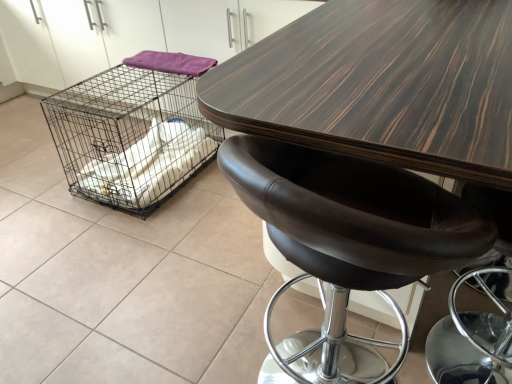
Describe the element at coordinates (381, 85) in the screenshot. I see `dark wood table at center` at that location.

What are the coordinates of `purple fabric at upper left` in the screenshot? It's located at (170, 63).

Measure the distance between point (445,224) and camera.

They are 65.10 centimeters apart.

Measure the distance between point (130, 118) and camera.

The depth of point (130, 118) is 9.49 feet.

Where is `dark wood table at center`? The image size is (512, 384). dark wood table at center is located at coordinates (x=381, y=85).

Considering the relative sizes of brown leather stool at center and purple fabric at upper left in the image provided, is brown leather stool at center wider than purple fabric at upper left?

Yes.

Is brown leather stool at center at the left side of purple fabric at upper left?

Incorrect, brown leather stool at center is not on the left side of purple fabric at upper left.

Is brown leather stool at center next to purple fabric at upper left and touching it?

brown leather stool at center is not next to purple fabric at upper left, and they're not touching.

Is brown leather stool at center smaller than purple fabric at upper left?

Actually, brown leather stool at center might be larger than purple fabric at upper left.

Looking at this image, are dark wood table at center and brown leather stool at center making contact?

There is a gap between dark wood table at center and brown leather stool at center.

Does dark wood table at center have a greater width compared to brown leather stool at center?

Yes.

Considering the positions of objects dark wood table at center and brown leather stool at center in the image provided, who is in front, dark wood table at center or brown leather stool at center?

brown leather stool at center.

From a real-world perspective, is dark wood table at center on top of brown leather stool at center?

Yes.

From the image's perspective, which one is positioned higher, black wire mesh cage at left or purple fabric at upper left?

purple fabric at upper left.

Can you confirm if black wire mesh cage at left is positioned to the right of purple fabric at upper left?

No.

From a real-world perspective, is black wire mesh cage at left under purple fabric at upper left?

Indeed, from a real-world perspective, black wire mesh cage at left is positioned beneath purple fabric at upper left.

Do you think black wire mesh cage at left is within purple fabric at upper left, or outside of it?

black wire mesh cage at left is located beyond the bounds of purple fabric at upper left.

Which is more to the right, dark wood table at center or black wire mesh cage at left?

Positioned to the right is dark wood table at center.

Who is bigger, dark wood table at center or black wire mesh cage at left?

→ Bigger between the two is dark wood table at center.

Which is nearer, [380,32] or [97,187]?

Point [380,32].

Who is shorter, dark wood table at center or black wire mesh cage at left?

With less height is black wire mesh cage at left.

Is brown leather stool at center positioned with its back to black wire mesh cage at left?

No, brown leather stool at center is not facing away from black wire mesh cage at left.

From a real-world perspective, is brown leather stool at center positioned over black wire mesh cage at left based on gravity?

Yes, from a real-world perspective, brown leather stool at center is above black wire mesh cage at left.

Measure the distance between brown leather stool at center and black wire mesh cage at left.

brown leather stool at center and black wire mesh cage at left are 5.22 feet apart from each other.

Is brown leather stool at center far from black wire mesh cage at left?

Yes, brown leather stool at center and black wire mesh cage at left are quite far apart.

Consider the image. From a real-world perspective, is purple fabric at upper left physically below brown leather stool at center?

No, from a real-world perspective, purple fabric at upper left is not beneath brown leather stool at center.

Who is shorter, purple fabric at upper left or brown leather stool at center?

Standing shorter between the two is purple fabric at upper left.

How different are the orientations of purple fabric at upper left and brown leather stool at center in degrees?

177 degrees.

Between purple fabric at upper left and black wire mesh cage at left, which one has larger width?

black wire mesh cage at left.

Which is more to the left, purple fabric at upper left or black wire mesh cage at left?

Positioned to the left is black wire mesh cage at left.

At what (x,y) coordinates should I click in order to perform the action: click on bird cage below the purple fabric at upper left (from the image's perspective). Please return your answer as a coordinate pair (x, y). Looking at the image, I should click on (133, 131).

Consider the image. Is purple fabric at upper left positioned in front of black wire mesh cage at left?

No, purple fabric at upper left is behind black wire mesh cage at left.

Where is `chair that appears on the right of purple fabric at upper left`? The image size is (512, 384). chair that appears on the right of purple fabric at upper left is located at coordinates (349, 241).

I want to click on chair below the dark wood table at center (from a real-world perspective), so click(349, 241).

When comparing their distances from black wire mesh cage at left, does brown leather stool at center or purple fabric at upper left seem further?

Based on the image, brown leather stool at center appears to be further to black wire mesh cage at left.

Which object lies further to the anchor point brown leather stool at center, dark wood table at center or purple fabric at upper left?

purple fabric at upper left lies further to brown leather stool at center than the other object.

From the image, which object appears to be nearer to dark wood table at center, purple fabric at upper left or black wire mesh cage at left?

Answer: purple fabric at upper left.

Which object lies nearer to the anchor point dark wood table at center, brown leather stool at center or black wire mesh cage at left?

brown leather stool at center.

Which object lies further to the anchor point dark wood table at center, purple fabric at upper left or brown leather stool at center?

Among the two, purple fabric at upper left is located further to dark wood table at center.

Which object lies further to the anchor point brown leather stool at center, purple fabric at upper left or dark wood table at center?

purple fabric at upper left is positioned further to the anchor brown leather stool at center.

Which object lies nearer to the anchor point dark wood table at center, black wire mesh cage at left or brown leather stool at center?

The object closer to dark wood table at center is brown leather stool at center.

Looking at this image, estimate the real-world distances between objects in this image. Which object is further from brown leather stool at center, black wire mesh cage at left or dark wood table at center?

black wire mesh cage at left.

This screenshot has height=384, width=512. I want to click on table between brown leather stool at center and purple fabric at upper left from front to back, so click(x=381, y=85).

You are a GUI agent. You are given a task and a screenshot of the screen. Output one action in this format:
    pyautogui.click(x=<x>, y=<y>)
    Task: Click on the table between brown leather stool at center and black wire mesh cage at left in the front-back direction
    This screenshot has height=384, width=512.
    Given the screenshot: What is the action you would take?
    pyautogui.click(x=381, y=85)

Where is `bird cage positioned between brown leather stool at center and purple fabric at upper left from near to far`? bird cage positioned between brown leather stool at center and purple fabric at upper left from near to far is located at coordinates (133, 131).

Where is `material between dark wood table at center and black wire mesh cage at left vertically`? The image size is (512, 384). material between dark wood table at center and black wire mesh cage at left vertically is located at coordinates (170, 63).